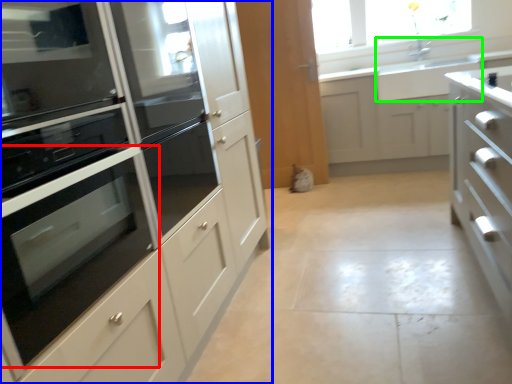
Question: Which object is positioned farthest from oven (highlighted by a red box)? Select from cabinetry (highlighted by a blue box) and sink (highlighted by a green box).

Choices:
 (A) cabinetry
 (B) sink

Answer: (B)